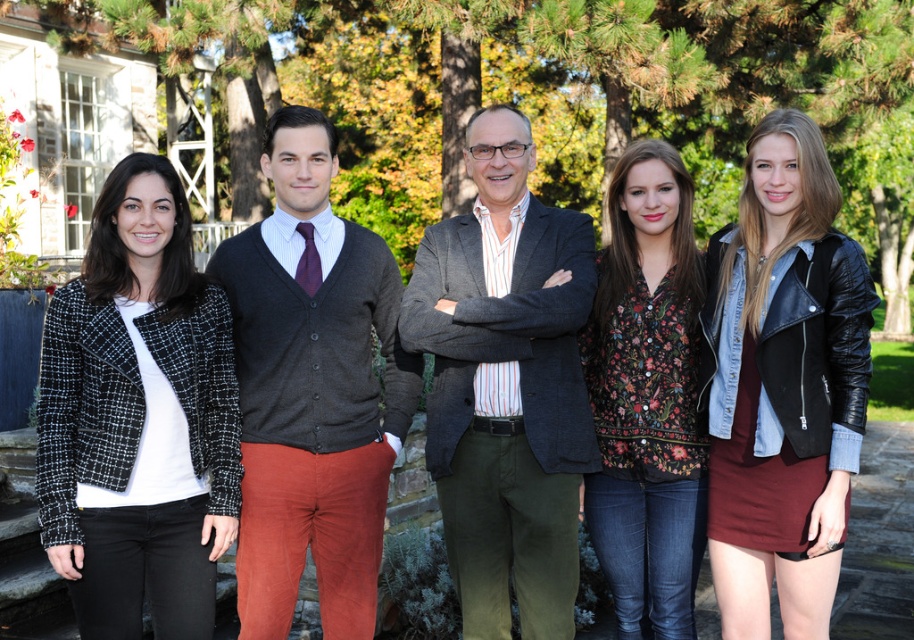
Question: Considering the relative positions of dark gray textured blazer at center and leather jacket at center in the image provided, where is dark gray textured blazer at center located with respect to leather jacket at center?

Choices:
 (A) right
 (B) left

Answer: (B)

Question: Considering the real-world distances, which object is closest to the leather jacket at center?

Choices:
 (A) black tweed jacket at left
 (B) dark gray wool sweater at center
 (C) floral print blouse at center
 (D) dark gray textured blazer at center

Answer: (C)

Question: Is dark gray textured blazer at center wider than leather jacket at center?

Choices:
 (A) yes
 (B) no

Answer: (A)

Question: From the image, what is the correct spatial relationship of black tweed jacket at left in relation to leather jacket at center?

Choices:
 (A) above
 (B) below

Answer: (B)

Question: Which point is farther from the camera taking this photo?

Choices:
 (A) (454, 288)
 (B) (692, 324)

Answer: (A)

Question: Which of the following is the closest to the observer?

Choices:
 (A) (847, 301)
 (B) (532, 410)
 (C) (594, 417)

Answer: (A)